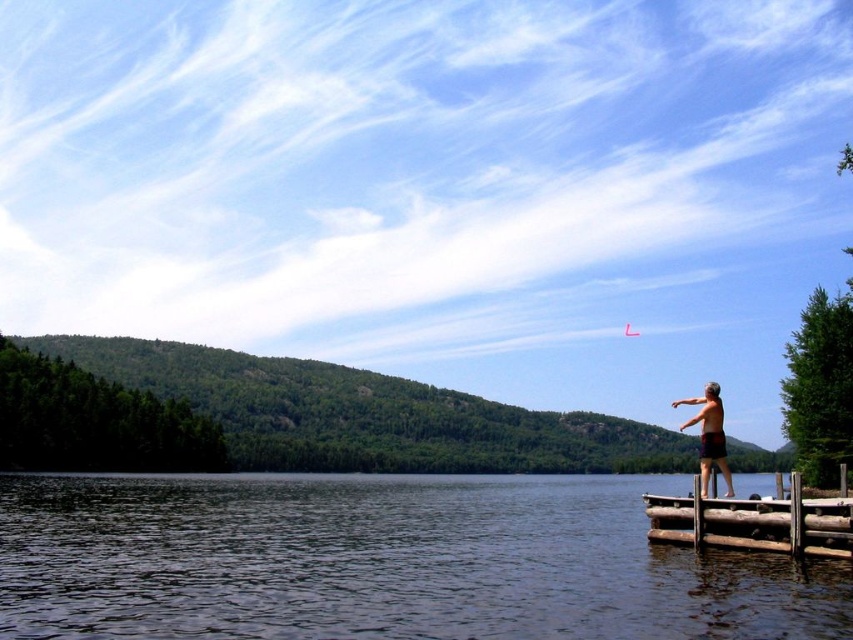
Question: Does dark green water at lower left have a greater width compared to red paper kite at upper center?

Choices:
 (A) no
 (B) yes

Answer: (B)

Question: In this image, where is dark green water at lower left located relative to brown wooden dock at lower right?

Choices:
 (A) left
 (B) right

Answer: (A)

Question: Which object appears farthest from the camera in this image?

Choices:
 (A) red paper kite at upper center
 (B) dark green water at lower left
 (C) brown wooden dock at lower right
 (D) skinny man at right

Answer: (A)

Question: Among these points, which one is farthest from the camera?

Choices:
 (A) (519, 634)
 (B) (833, 544)
 (C) (711, 422)

Answer: (C)

Question: Observing the image, what is the correct spatial positioning of dark green water at lower left in reference to brown wooden dock at lower right?

Choices:
 (A) above
 (B) below

Answer: (B)

Question: Which object is the farthest from the skinny man at right?

Choices:
 (A) brown wooden dock at lower right
 (B) red paper kite at upper center

Answer: (B)